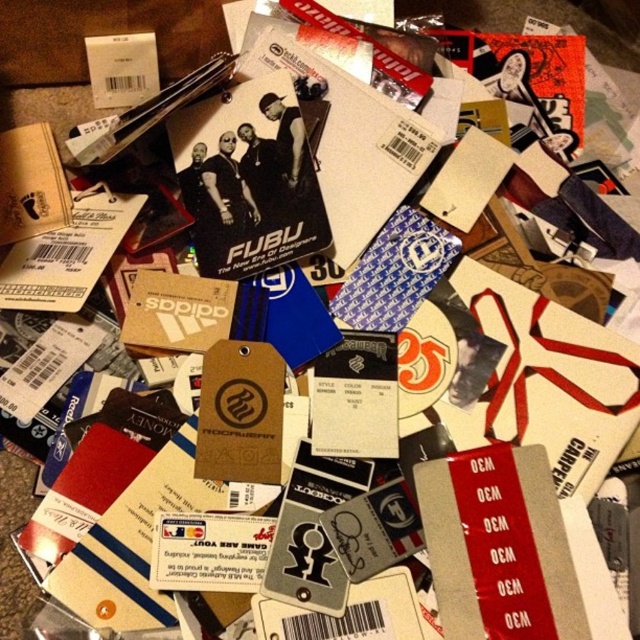
You are organizing a collection of clothing tags and need to place the matte black card at center and the brown cardboard at upper left into two boxes. The first box can only hold items smaller than the other. Which box should each tag go into?

The matte black card at center is bigger than the brown cardboard at upper left, so the matte black card at center should go into the larger box and the brown cardboard at upper left into the smaller one.

You are organizing a collection of clothing tags and need to place the matte black card at center and the brown cardboard at upper left into a display case. Based on their positions in the image, which object should you place first to ensure proper alignment?

The brown cardboard at upper left should be placed first because the matte black card at center is positioned to its right, meaning the brown cardboard at upper left needs to be placed first to maintain their relative positions.

You are organizing a collection of clothing tags and need to place them in a display case. The case has a height limit of 10 cm. You have the matte black card at center and the brown cardboard at upper left. Which one will exceed the height limit if placed vertically?

The matte black card at center is taller than the brown cardboard at upper left. Since the display case has a height limit of 10 cm, the matte black card at center may exceed the height limit if placed vertically, while the brown cardboard at upper left might fit within it.